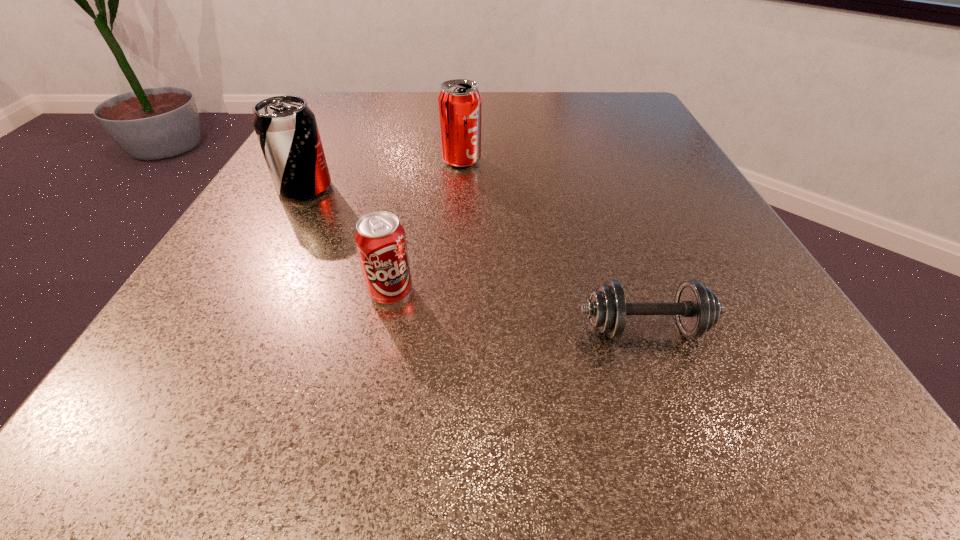
Image resolution: width=960 pixels, height=540 pixels. Find the location of `free region located 0.210m on the back of the nearest soda`. free region located 0.210m on the back of the nearest soda is located at coordinates (411, 194).

At what (x,y) coordinates should I click in order to perform the action: click on vacant space located 0.140m on the left of the dumbbell. Please return your answer as a coordinate pair (x, y). This screenshot has height=540, width=960. Looking at the image, I should click on (463, 328).

The width and height of the screenshot is (960, 540). What are the coordinates of `object present at the left edge` in the screenshot? It's located at (286, 128).

Find the location of a particular element. object at the right edge is located at coordinates (697, 309).

This screenshot has width=960, height=540. What are the coordinates of `vacant space at the far edge of the desktop` in the screenshot? It's located at (436, 111).

In the image, there is a desktop. What are the coordinates of `vacant space at the near edge` in the screenshot? It's located at (579, 402).

In the image, there is a desktop. Where is `vacant area at the left edge`? vacant area at the left edge is located at coordinates (294, 282).

Identify the location of vacant space at the right edge of the desktop. (714, 206).

In the image, there is a desktop. At what (x,y) coordinates should I click in order to perform the action: click on vacant area at the far left corner. Please return your answer as a coordinate pair (x, y). The height and width of the screenshot is (540, 960). Looking at the image, I should click on (336, 131).

In the image, there is a desktop. In order to click on blank space at the near left corner in this screenshot , I will do `click(84, 448)`.